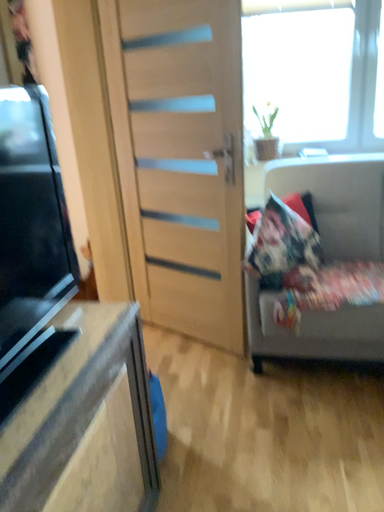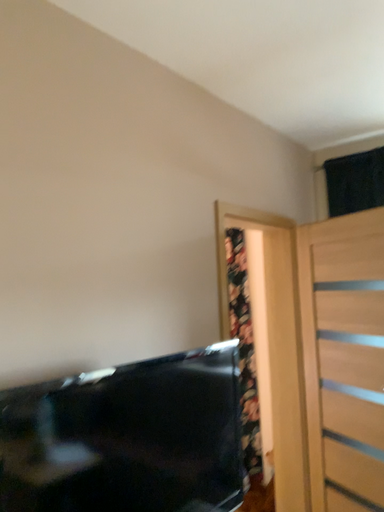
Question: Which way did the camera rotate in the video?

Choices:
 (A) rotated left
 (B) rotated right

Answer: (A)